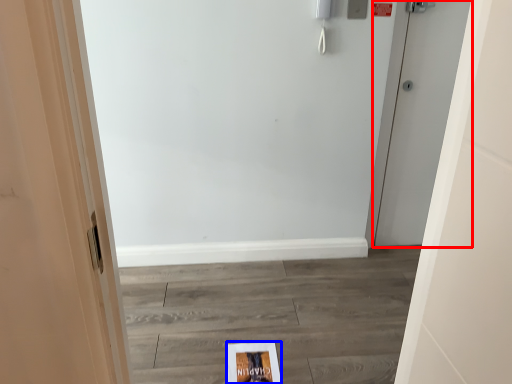
Question: Which object appears closest to the camera in this image, door (highlighted by a red box) or flyer (highlighted by a blue box)?

Choices:
 (A) door
 (B) flyer

Answer: (B)